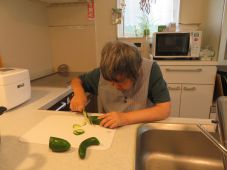
This screenshot has height=170, width=227. I want to click on sink, so click(x=165, y=153).